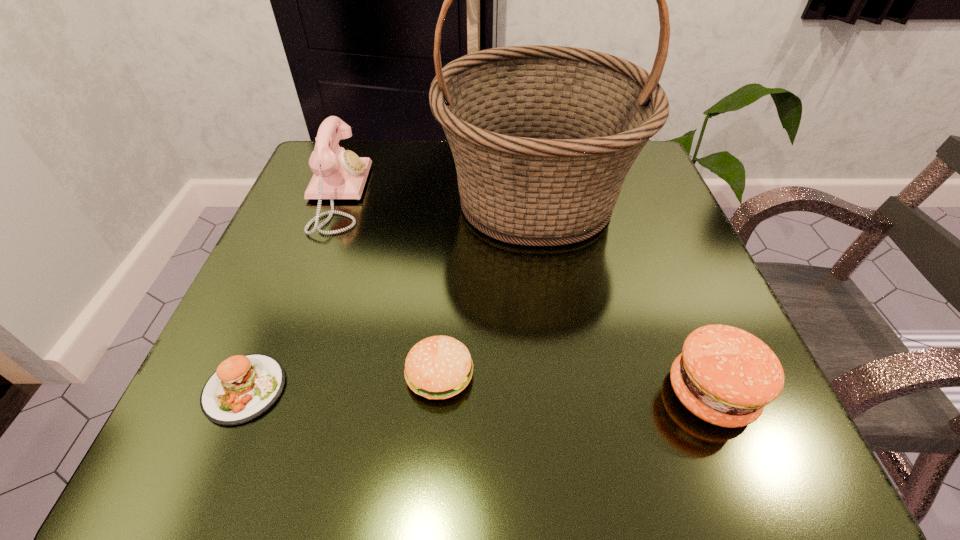
Locate an element on the screen. The width and height of the screenshot is (960, 540). object located in the near left corner section of the desktop is located at coordinates (243, 387).

At what (x,y) coordinates should I click in order to perform the action: click on object that is at the far right corner. Please return your answer as a coordinate pair (x, y). This screenshot has width=960, height=540. Looking at the image, I should click on (543, 137).

This screenshot has height=540, width=960. I want to click on object located in the near right corner section of the desktop, so click(x=725, y=376).

Where is `vacant area at the far edge of the desktop`? vacant area at the far edge of the desktop is located at coordinates (396, 144).

In the image, there is a desktop. Identify the location of free space at the near edge. This screenshot has height=540, width=960. (573, 442).

Where is `free space at the left edge`? This screenshot has width=960, height=540. free space at the left edge is located at coordinates (361, 218).

Find the location of a particular element. Image resolution: width=960 pixels, height=540 pixels. vacant space at the near left corner of the desktop is located at coordinates (191, 447).

You are a GUI agent. You are given a task and a screenshot of the screen. Output one action in this format:
    pyautogui.click(x=<x>, y=<y>)
    Task: Click on the unoccupied position between the shortest object and the third shortest object
    The height and width of the screenshot is (540, 960).
    Given the screenshot: What is the action you would take?
    pyautogui.click(x=478, y=391)

Image resolution: width=960 pixels, height=540 pixels. I want to click on blank region between the tallest object and the second tallest object, so click(x=436, y=197).

At what (x,y) coordinates should I click in order to perform the action: click on empty space between the fourth shortest object and the shortest patty. Please return your answer as a coordinate pair (x, y). Image resolution: width=960 pixels, height=540 pixels. Looking at the image, I should click on (291, 292).